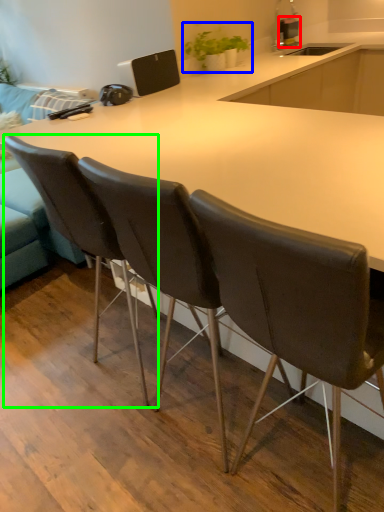
Question: Based on their relative distances, which object is farther from kitchen appliance (highlighted by a red box)? Choose from houseplant (highlighted by a blue box) and chair (highlighted by a green box).

Choices:
 (A) houseplant
 (B) chair

Answer: (B)